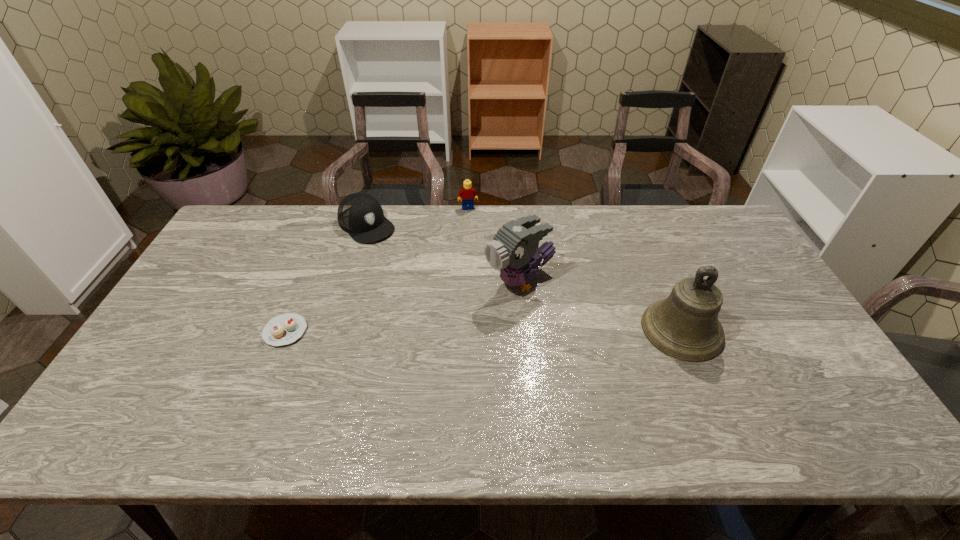
This screenshot has height=540, width=960. What are the coordinates of `the closest object to the bird` in the screenshot? It's located at (685, 326).

Locate an element on the screen. object that stands as the closest to the bird is located at coordinates click(685, 326).

What are the coordinates of `vacant space that satisfies the following two spatial constraints: 1. on the front side of the bell; 2. on the left side of the bird` in the screenshot? It's located at (524, 329).